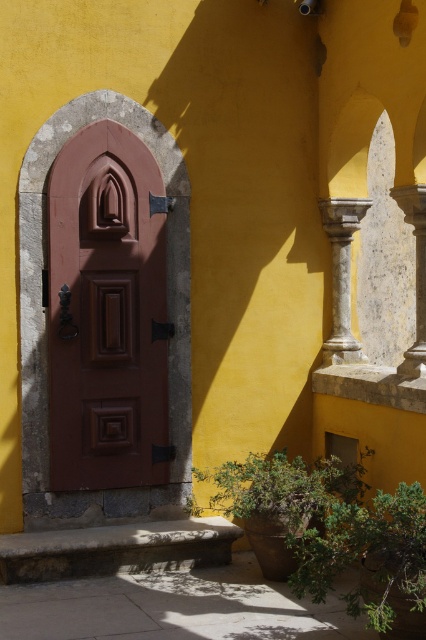
Question: Which of the following is the closest to the observer?

Choices:
 (A) matte wood door at center
 (B) smooth stone column at right
 (C) white marble column at center

Answer: (B)

Question: Estimate the real-world distances between objects in this image. Which object is closer to the white marble column at center?

Choices:
 (A) smooth stone column at right
 (B) matte wood door at center

Answer: (A)

Question: Which point is farther to the camera?

Choices:
 (A) smooth stone column at right
 (B) white marble column at center
 (C) matte wood door at center

Answer: (B)

Question: Is matte wood door at center below white marble column at center?

Choices:
 (A) no
 (B) yes

Answer: (B)

Question: Can you confirm if matte wood door at center is bigger than smooth stone column at right?

Choices:
 (A) yes
 (B) no

Answer: (A)

Question: Is matte wood door at center bigger than smooth stone column at right?

Choices:
 (A) no
 (B) yes

Answer: (B)